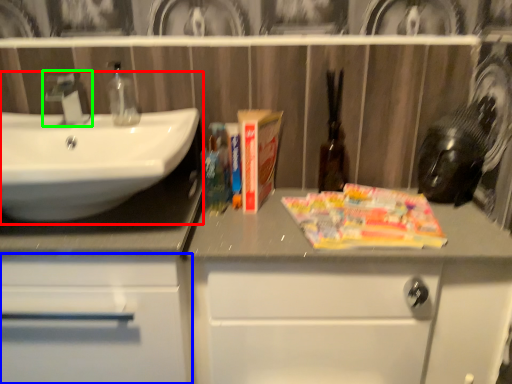
Question: Which object is positioned farthest from sink (highlighted by a red box)? Select from bathroom cabinet (highlighted by a blue box) and tap (highlighted by a green box).

Choices:
 (A) bathroom cabinet
 (B) tap

Answer: (A)